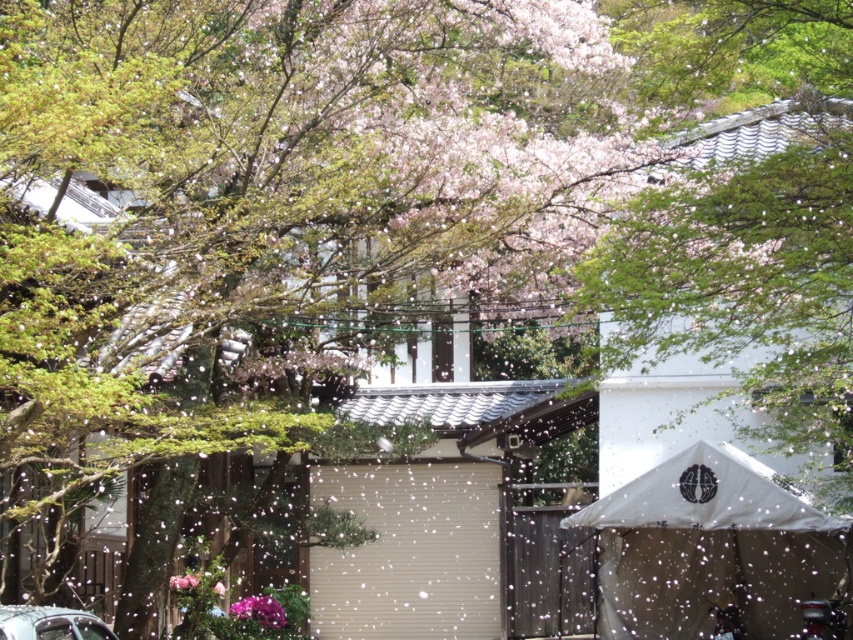
From the picture: You are standing in the scene and want to place a small bench between the white canvas canopy at center and the pink matte flower at lower center. Based on their positions, which object should the bench be closer to?

The bench should be placed closer to the pink matte flower at lower center because the white canvas canopy at center is to the right of the pink matte flower at lower center, so the flower is on the left side and the canopy is on the right. Therefore, the bench should be positioned closer to the flower to maintain symmetry or balance between the two objects.

You are standing at the entrance of the garage door in the midground. You need to walk to the pink matte flower at lower center. Which direction should you go relative to the metallic silver car at lower left?

You should go to the right of the metallic silver car at lower left to reach the pink matte flower at lower center because the metallic silver car at lower left is to the left of pink matte flower at lower center.

In the scene shown: You are standing in the residential area depicted in the image. There are two points marked in the scene. The first point is at coordinates point (90, 620) and the second point is at point (264, 604). Which of these two points is closer to you?

Point (90, 620) is closer to the viewer than point (264, 604).